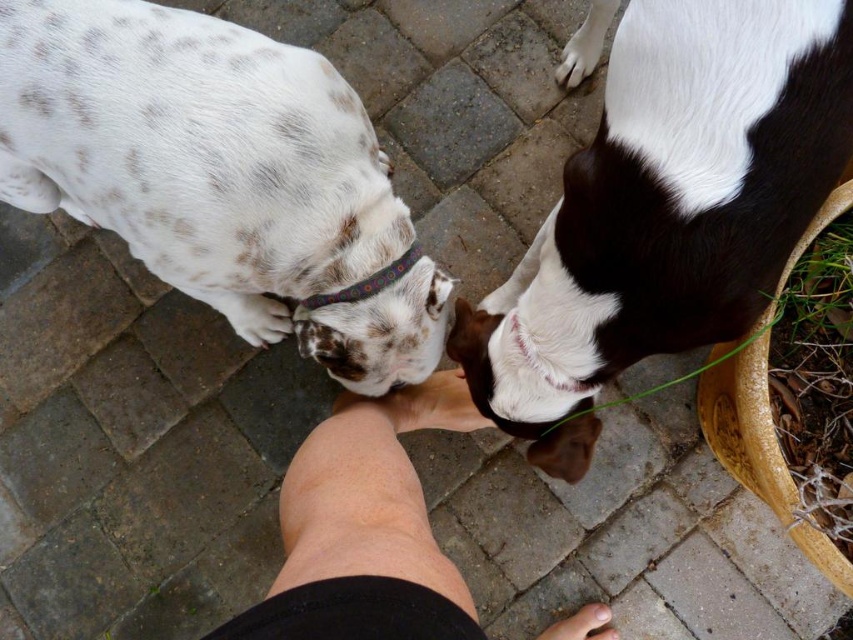
Question: Is white and brown fur at lower right wider than skinny leg at center?

Choices:
 (A) no
 (B) yes

Answer: (B)

Question: Estimate the real-world distances between objects in this image. Which object is farther from the white and brown fur at lower right?

Choices:
 (A) skinny leg at center
 (B) spotted fur at center

Answer: (B)

Question: Which point is farther to the camera?

Choices:
 (A) white and brown fur at lower right
 (B) multicolored fabric neckband at center
 (C) spotted fur at center

Answer: (B)

Question: Is spotted fur at center to the right of skinny leg at center from the viewer's perspective?

Choices:
 (A) no
 (B) yes

Answer: (A)

Question: Considering the relative positions of spotted fur at center and white and brown fur at lower right in the image provided, where is spotted fur at center located with respect to white and brown fur at lower right?

Choices:
 (A) right
 (B) left

Answer: (B)

Question: Which object appears farthest from the camera in this image?

Choices:
 (A) white and brown fur at lower right
 (B) multicolored fabric neckband at center

Answer: (B)